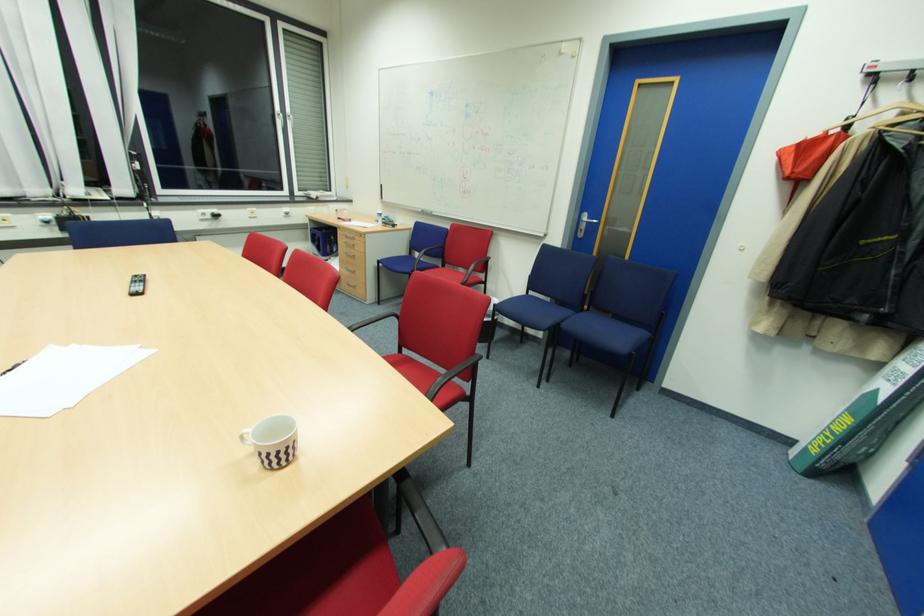
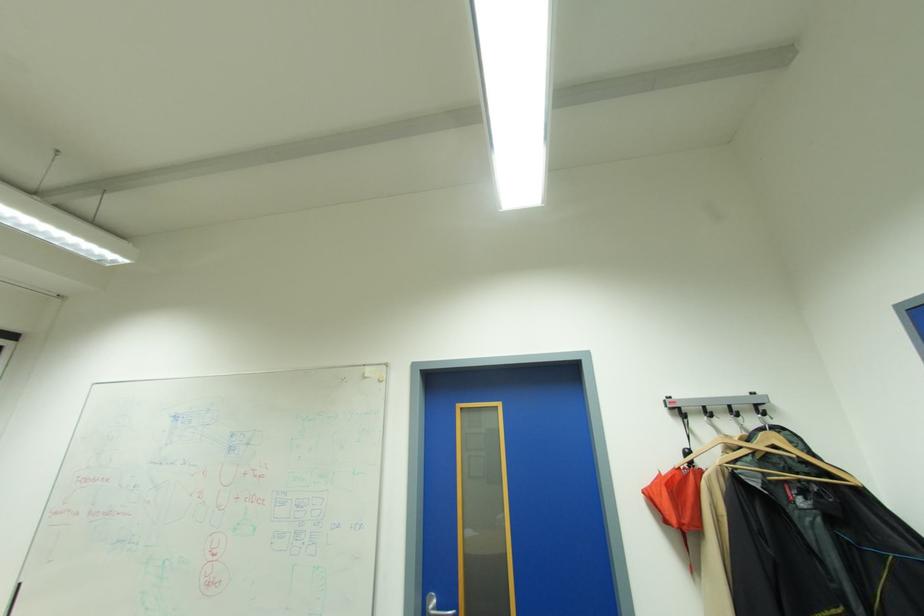
Find the pixel in the second image that matches pixel 880 79 in the first image.

(683, 411)